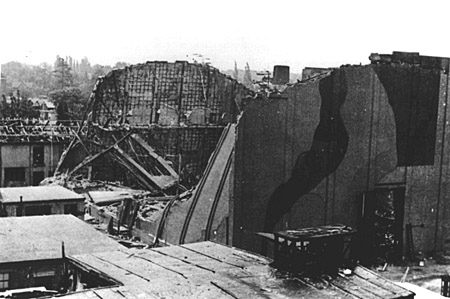
Identify the location of wall. (315, 132).